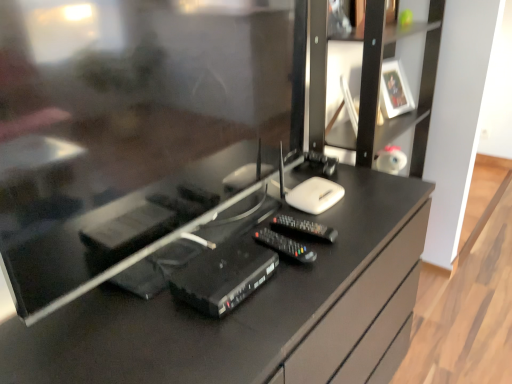
Question: Is black plastic remote control at center, acting as the 1th equipment starting from the right, bigger than white glossy picture frame at upper right?

Choices:
 (A) no
 (B) yes

Answer: (A)

Question: Does black plastic remote control at center, acting as the 1th equipment starting from the right, come behind white glossy picture frame at upper right?

Choices:
 (A) yes
 (B) no

Answer: (B)

Question: Is black plastic remote control at center, acting as the 1th equipment starting from the right, oriented towards white glossy picture frame at upper right?

Choices:
 (A) yes
 (B) no

Answer: (B)

Question: Does black plastic remote control at center, acting as the 1th equipment starting from the right, appear on the left side of white glossy picture frame at upper right?

Choices:
 (A) yes
 (B) no

Answer: (A)

Question: From the image's perspective, is black plastic router at center, placed as the 2th equipment when sorted from right to left, above or below black plastic remote at center?

Choices:
 (A) above
 (B) below

Answer: (B)

Question: From their relative heights in the image, would you say black plastic router at center, placed as the first equipment when sorted from left to right, is taller or shorter than black plastic remote at center?

Choices:
 (A) short
 (B) tall

Answer: (B)

Question: Looking at their shapes, would you say black plastic router at center, placed as the 2th equipment when sorted from right to left, is wider or thinner than black plastic remote at center?

Choices:
 (A) wide
 (B) thin

Answer: (B)

Question: In terms of size, does black plastic router at center, placed as the 2th equipment when sorted from right to left, appear bigger or smaller than black plastic remote at center?

Choices:
 (A) small
 (B) big

Answer: (B)

Question: Considering their positions, is white glossy picture frame at upper right located in front of or behind black plastic router at center, placed as the 2th equipment when sorted from right to left?

Choices:
 (A) front
 (B) behind

Answer: (B)

Question: Is white glossy picture frame at upper right bigger or smaller than black plastic router at center, placed as the 2th equipment when sorted from right to left?

Choices:
 (A) small
 (B) big

Answer: (B)

Question: Which is correct: white glossy picture frame at upper right is inside black plastic router at center, placed as the 2th equipment when sorted from right to left, or outside of it?

Choices:
 (A) outside
 (B) inside

Answer: (A)

Question: From a real-world perspective, is white glossy picture frame at upper right physically located above or below black plastic router at center, placed as the first equipment when sorted from left to right?

Choices:
 (A) above
 (B) below

Answer: (A)

Question: In terms of height, does white glossy picture frame at upper right look taller or shorter compared to black plastic remote at center?

Choices:
 (A) short
 (B) tall

Answer: (B)

Question: Does point (382, 89) appear closer or farther from the camera than point (291, 216)?

Choices:
 (A) closer
 (B) farther

Answer: (B)